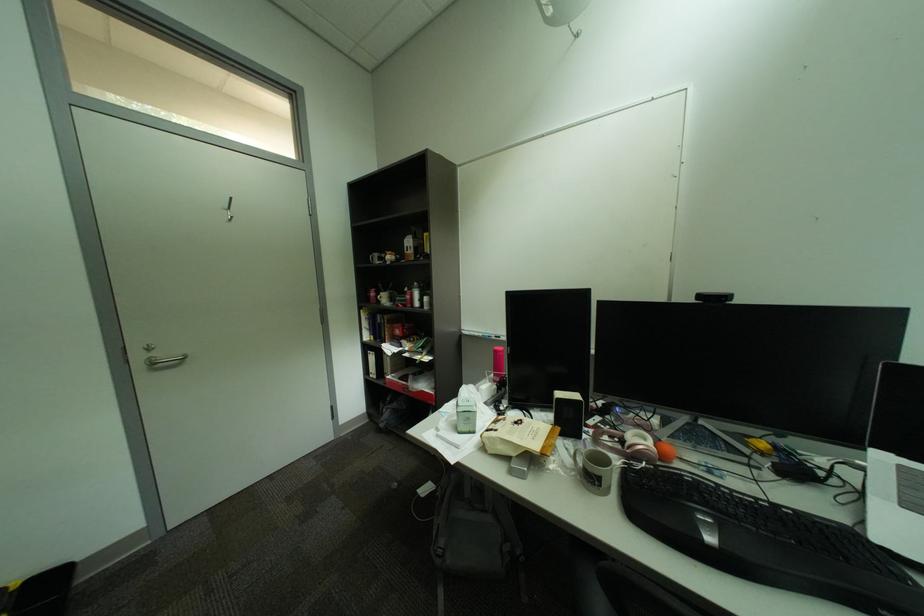
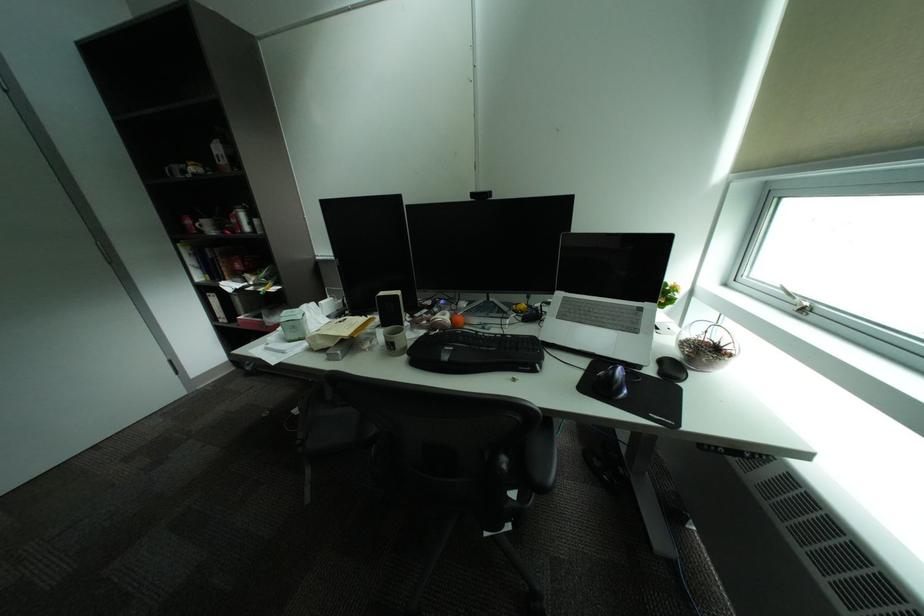
In the second image, find the point that corresponds to (x=374, y=302) in the first image.

(189, 233)